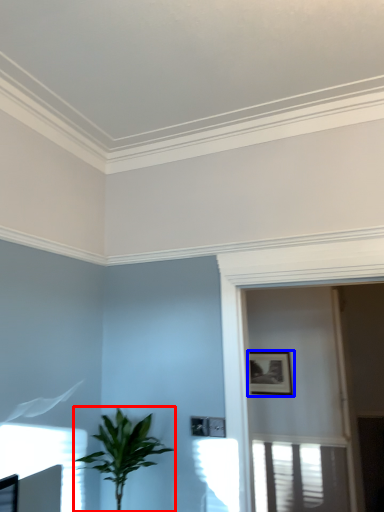
Question: Which of the following is the closest to the observer, houseplant (highlighted by a red box) or picture frame (highlighted by a blue box)?

Choices:
 (A) houseplant
 (B) picture frame

Answer: (A)